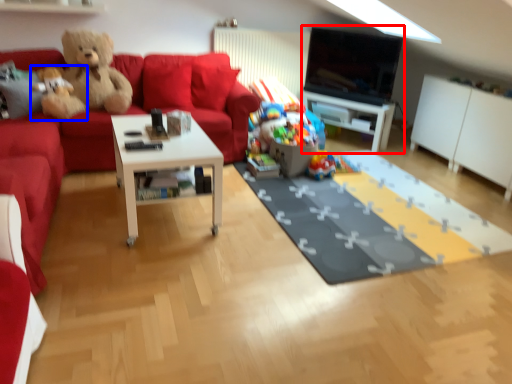
Question: Which object is further to the camera taking this photo, entertainment center (highlighted by a red box) or teddy bear (highlighted by a blue box)?

Choices:
 (A) entertainment center
 (B) teddy bear

Answer: (A)